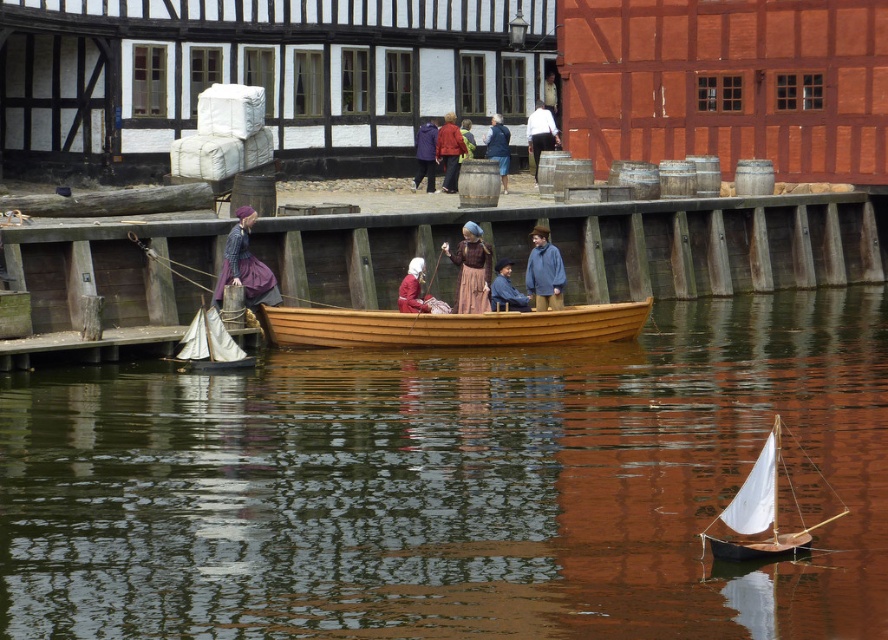
Who is positioned more to the left, white sailboat at lower right or matte purple dress at center?

Positioned to the left is matte purple dress at center.

Can you confirm if white sailboat at lower right is smaller than matte purple dress at center?

Indeed, white sailboat at lower right has a smaller size compared to matte purple dress at center.

Is point (789, 541) farther from camera compared to point (279, 300)?

That is False.

This screenshot has height=640, width=888. Find the location of `white sailboat at lower right`. white sailboat at lower right is located at coordinates (763, 509).

The width and height of the screenshot is (888, 640). I want to click on matte purple dress at center, so click(244, 266).

Can you confirm if matte purple dress at center is shorter than wooden sailboat at center?

No.

Does point (215, 298) lie in front of point (223, 333)?

No, (215, 298) is behind (223, 333).

At what (x,y) coordinates should I click in order to perform the action: click on matte purple dress at center. Please return your answer as a coordinate pair (x, y). Image resolution: width=888 pixels, height=640 pixels. Looking at the image, I should click on (244, 266).

Is white sailboat at lower right shorter than wooden sailboat at center?

Yes.

Can you confirm if white sailboat at lower right is taller than wooden sailboat at center?

No, white sailboat at lower right is not taller than wooden sailboat at center.

Is point (779, 420) behind point (220, 337)?

No.

Locate an element on the screen. white sailboat at lower right is located at coordinates (763, 509).